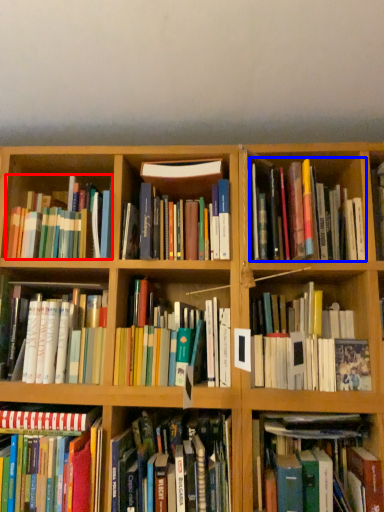
Question: Which point is further to the camera, book (highlighted by a red box) or book (highlighted by a blue box)?

Choices:
 (A) book
 (B) book

Answer: (A)